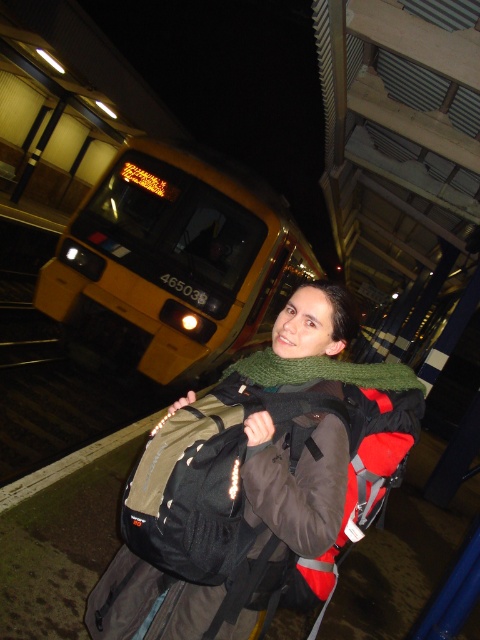
Question: Which point is farther from the camera taking this photo?

Choices:
 (A) coord(289,314)
 (B) coord(254,253)

Answer: (B)

Question: Which object is farther from the camera taking this photo?

Choices:
 (A) yellow matte train at upper left
 (B) green knitted scarf at center

Answer: (A)

Question: Which point is closer to the camera?

Choices:
 (A) green knitted scarf at center
 (B) yellow matte train at upper left

Answer: (A)

Question: Is yellow matte train at upper left above green knitted scarf at center?

Choices:
 (A) no
 (B) yes

Answer: (B)

Question: In this image, where is yellow matte train at upper left located relative to green knitted scarf at center?

Choices:
 (A) left
 (B) right

Answer: (A)

Question: Does yellow matte train at upper left have a lesser width compared to green knitted scarf at center?

Choices:
 (A) yes
 (B) no

Answer: (B)